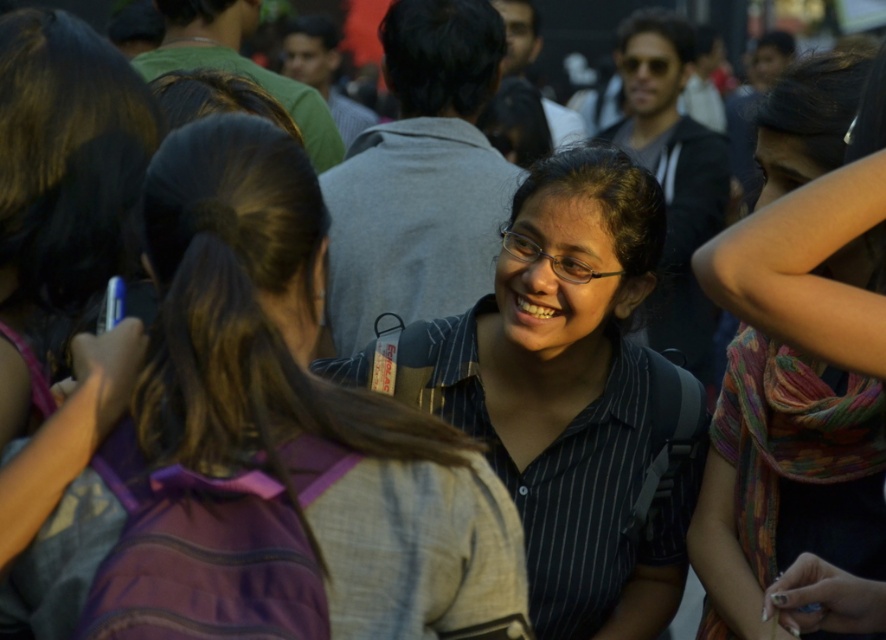
Question: Is black striped shirt at center to the right of multicolored scarf at center from the viewer's perspective?

Choices:
 (A) yes
 (B) no

Answer: (B)

Question: Is the position of striped shirt at center more distant than that of black striped shirt at center?

Choices:
 (A) no
 (B) yes

Answer: (A)

Question: Is striped shirt at center thinner than multicolored scarf at center?

Choices:
 (A) yes
 (B) no

Answer: (B)

Question: Which of these objects is positioned farthest from the striped shirt at center?

Choices:
 (A) multicolored scarf at center
 (B) black striped shirt at center

Answer: (B)

Question: Among these points, which one is nearest to the camera?

Choices:
 (A) (189, 566)
 (B) (799, 512)

Answer: (A)

Question: Which object is closer to the camera taking this photo?

Choices:
 (A) black striped shirt at center
 (B) multicolored scarf at center
 (C) striped shirt at center

Answer: (C)